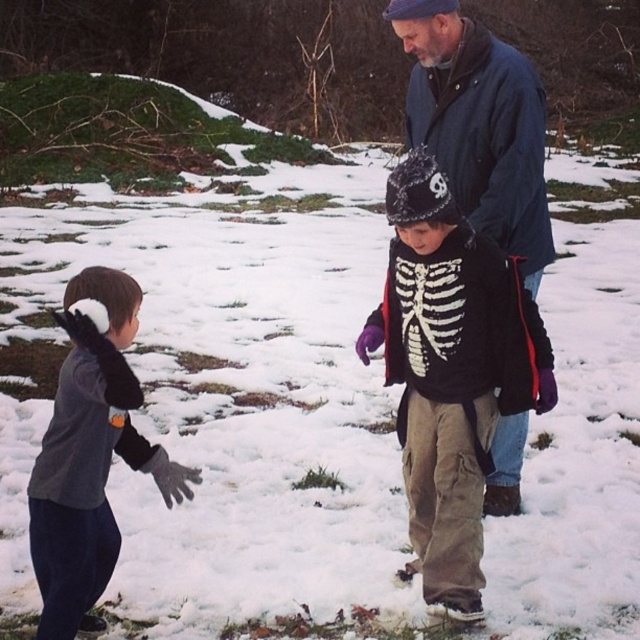
Question: Which point is farther to the camera?

Choices:
 (A) (76, 520)
 (B) (515, 305)

Answer: (B)

Question: Can you confirm if black cotton sweater with skeleton design at center is bigger than gray fleece shirt at left?

Choices:
 (A) yes
 (B) no

Answer: (A)

Question: Among these objects, which one is nearest to the camera?

Choices:
 (A) black cotton sweater with skeleton design at center
 (B) gray fleece shirt at left

Answer: (B)

Question: Can you confirm if black cotton sweater with skeleton design at center is smaller than gray fleece shirt at left?

Choices:
 (A) yes
 (B) no

Answer: (B)

Question: Is black cotton sweater with skeleton design at center wider than gray fleece shirt at left?

Choices:
 (A) no
 (B) yes

Answer: (B)